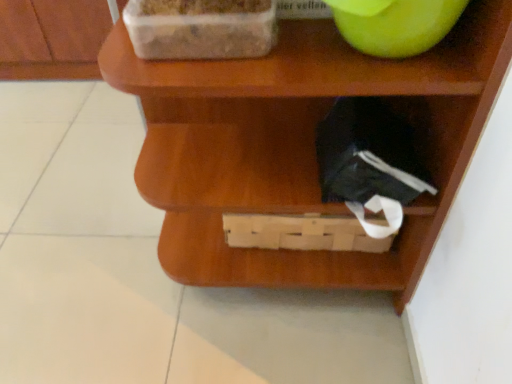
Question: Can you confirm if green matte apple at upper right is wider than transparent plastic container at upper left?

Choices:
 (A) yes
 (B) no

Answer: (A)

Question: Considering the relative sizes of green matte apple at upper right and transparent plastic container at upper left in the image provided, is green matte apple at upper right bigger than transparent plastic container at upper left?

Choices:
 (A) no
 (B) yes

Answer: (B)

Question: Is green matte apple at upper right positioned far away from transparent plastic container at upper left?

Choices:
 (A) yes
 (B) no

Answer: (B)

Question: Can you confirm if green matte apple at upper right is thinner than transparent plastic container at upper left?

Choices:
 (A) no
 (B) yes

Answer: (A)

Question: From the image's perspective, would you say green matte apple at upper right is positioned over transparent plastic container at upper left?

Choices:
 (A) no
 (B) yes

Answer: (B)

Question: Would you say wooden basket at lower center is inside or outside green matte apple at upper right?

Choices:
 (A) inside
 (B) outside

Answer: (B)

Question: From the image's perspective, is wooden basket at lower center located above or below green matte apple at upper right?

Choices:
 (A) below
 (B) above

Answer: (A)

Question: Considering the positions of wooden basket at lower center and green matte apple at upper right in the image, is wooden basket at lower center wider or thinner than green matte apple at upper right?

Choices:
 (A) wide
 (B) thin

Answer: (A)

Question: Visually, is wooden basket at lower center positioned to the left or to the right of green matte apple at upper right?

Choices:
 (A) left
 (B) right

Answer: (A)

Question: Is green matte apple at upper right wider or thinner than transparent plastic container at upper left?

Choices:
 (A) thin
 (B) wide

Answer: (B)

Question: Would you say green matte apple at upper right is to the left or to the right of transparent plastic container at upper left in the picture?

Choices:
 (A) right
 (B) left

Answer: (A)

Question: Considering their positions, is green matte apple at upper right located in front of or behind transparent plastic container at upper left?

Choices:
 (A) front
 (B) behind

Answer: (A)

Question: From a real-world perspective, is green matte apple at upper right positioned above or below transparent plastic container at upper left?

Choices:
 (A) below
 (B) above

Answer: (B)

Question: Is transparent plastic container at upper left inside or outside of wooden basket at lower center?

Choices:
 (A) inside
 (B) outside

Answer: (A)

Question: Is transparent plastic container at upper left bigger or smaller than wooden basket at lower center?

Choices:
 (A) small
 (B) big

Answer: (A)